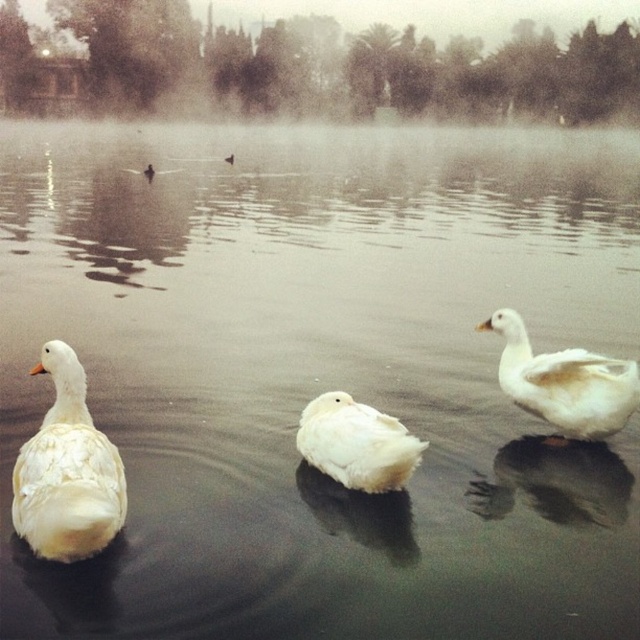
Does foggy mist at upper center come in front of white fluffy goose at left?

No, it is not.

Does foggy mist at upper center appear over white fluffy goose at left?

Yes.

Which is behind, point (579, 36) or point (104, 442)?

Point (579, 36)

Image resolution: width=640 pixels, height=640 pixels. In order to click on foggy mist at upper center in this screenshot , I will do `click(310, 67)`.

Who is positioned more to the right, foggy mist at upper center or white fluffy goose at center?

From the viewer's perspective, white fluffy goose at center appears more on the right side.

Identify the location of foggy mist at upper center. (310, 67).

I want to click on foggy mist at upper center, so click(310, 67).

Does white fluffy goose at right appear over white fluffy goose at center?

Yes, white fluffy goose at right is above white fluffy goose at center.

Is point (560, 436) positioned before point (304, 436)?

That is False.

This screenshot has width=640, height=640. I want to click on white fluffy goose at right, so click(564, 381).